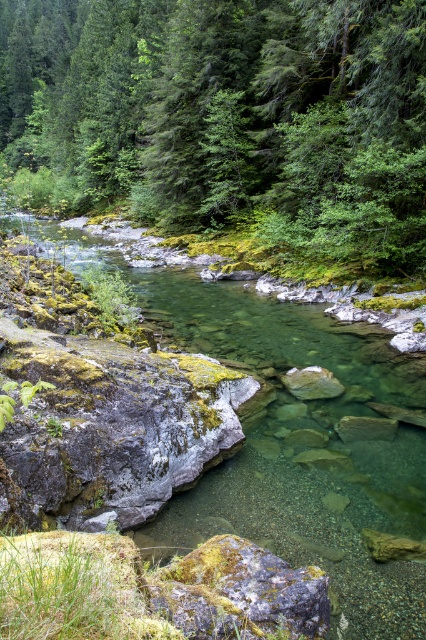
Does point (324, 172) come farther from viewer compared to point (236, 544)?

Yes, it is behind point (236, 544).

Is point (321, 214) closer to viewer compared to point (192, 621)?

No, it is behind (192, 621).

Find the location of a particular element. This screenshot has width=426, height=640. green matte tree at center is located at coordinates (226, 120).

Locate an element on the screen. The image size is (426, 640). green matte tree at center is located at coordinates (226, 120).